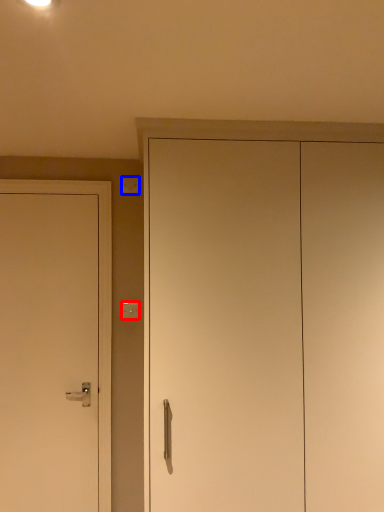
Question: Which point is closer to the camera, light switch (highlighted by a red box) or light switch (highlighted by a blue box)?

Choices:
 (A) light switch
 (B) light switch

Answer: (A)